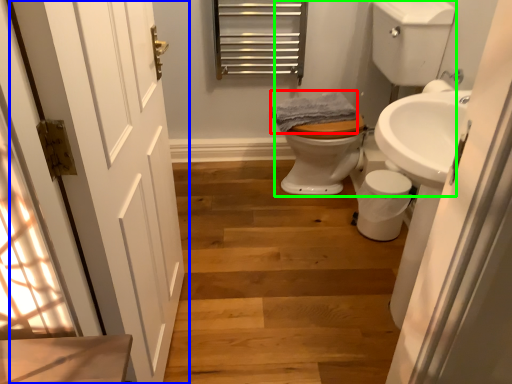
Question: Based on their relative distances, which object is farther from bath towel (highlighted by a red box)? Choose from door (highlighted by a blue box) and landing (highlighted by a green box).

Choices:
 (A) door
 (B) landing

Answer: (A)